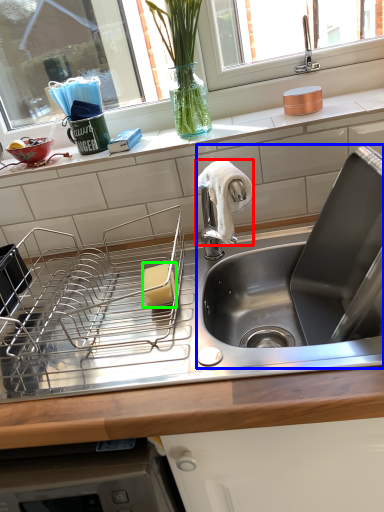
Question: Based on their relative distances, which object is nearer to cloth (highlighted by a red box)? Choose from sink (highlighted by a blue box) and food (highlighted by a green box).

Choices:
 (A) sink
 (B) food

Answer: (B)